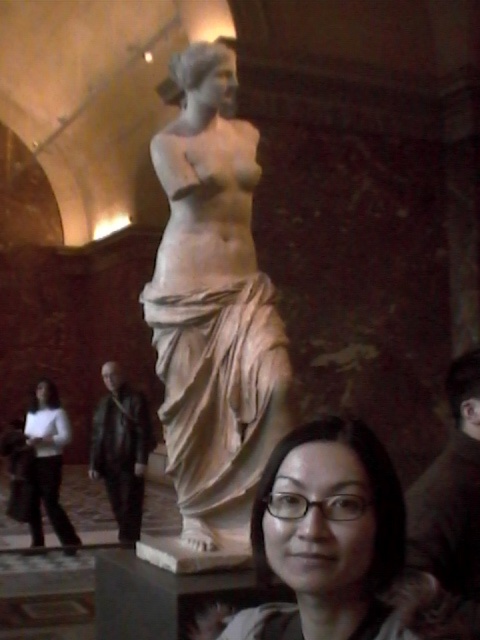
Question: Which object is farther from the camera taking this photo?

Choices:
 (A) white marble statue at center
 (B) matte white statue at center

Answer: (A)

Question: Can you confirm if white marble statue at center is positioned below matte white statue at center?

Choices:
 (A) no
 (B) yes

Answer: (A)

Question: Which of the following is the closest to the observer?

Choices:
 (A) matte white statue at center
 (B) white matte pants at lower left
 (C) white marble statue at center

Answer: (A)

Question: Which is nearer to the white matte pants at lower left?

Choices:
 (A) white marble statue at center
 (B) matte white statue at center

Answer: (A)

Question: Is white marble statue at center below white matte pants at lower left?

Choices:
 (A) no
 (B) yes

Answer: (A)

Question: Is white marble statue at center bigger than matte white statue at center?

Choices:
 (A) yes
 (B) no

Answer: (A)